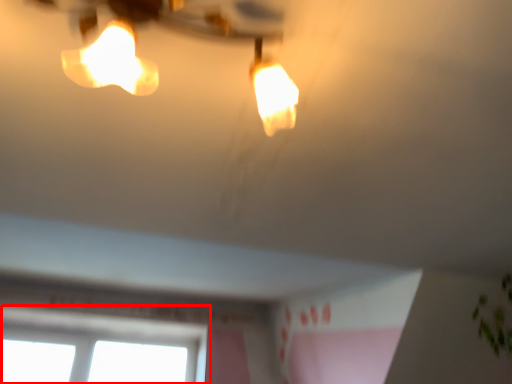
Question: From the image's perspective, where is window (annotated by the red box) located relative to lamp?

Choices:
 (A) below
 (B) above

Answer: (A)